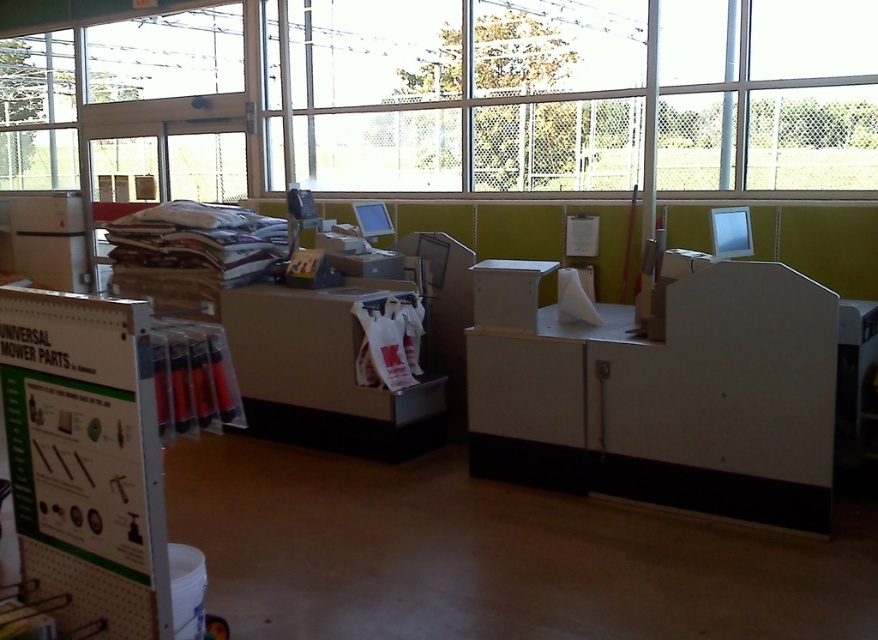
Is white matte box at center to the left of satin silver monitor at upper right from the viewer's perspective?

Yes, white matte box at center is to the left of satin silver monitor at upper right.

Is white matte box at center bigger than satin silver monitor at upper right?

Correct, white matte box at center is larger in size than satin silver monitor at upper right.

The height and width of the screenshot is (640, 878). I want to click on white matte box at center, so tap(507, 292).

Can you confirm if white paper bag at center is positioned to the right of white matte box at center?

No, white paper bag at center is not to the right of white matte box at center.

Is the position of white paper bag at center more distant than that of white matte box at center?

Yes.

The height and width of the screenshot is (640, 878). Identify the location of white paper bag at center. (389, 342).

Between point (282, 257) and point (481, 262), which one is positioned behind?

Positioned behind is point (282, 257).

Is the position of white paper at upper left less distant than that of white matte box at center?

That is False.

Which is in front, point (229, 285) or point (558, 264)?

Positioned in front is point (558, 264).

This screenshot has height=640, width=878. In order to click on white paper at upper left in this screenshot , I will do `click(199, 240)`.